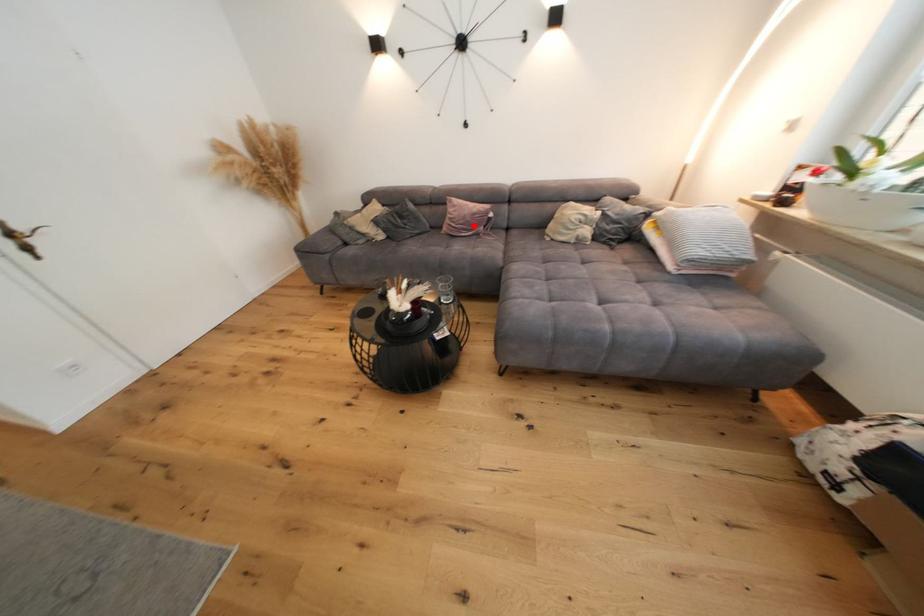
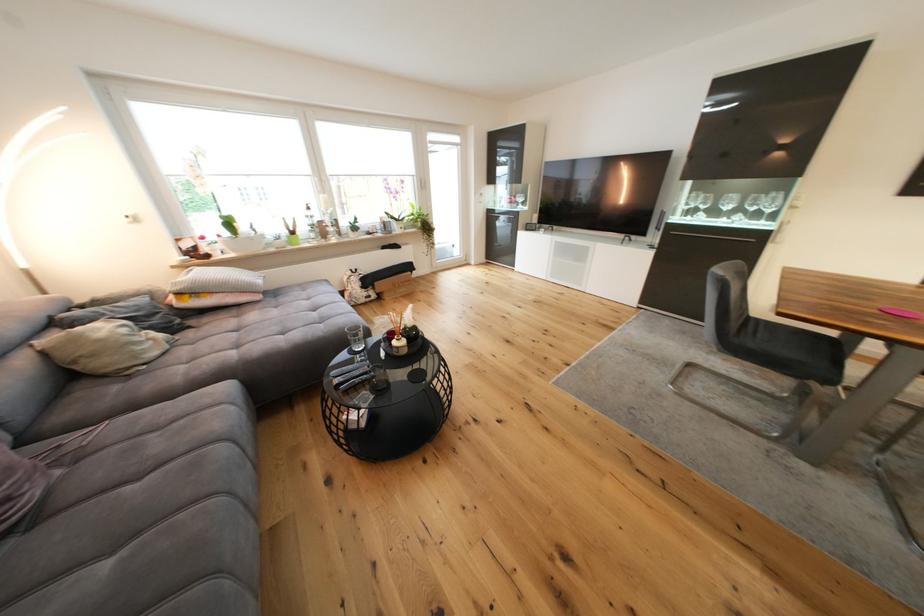
Question: I am providing you with two images of the same scene from different viewpoints. In image1, a red point is highlighted. Considering the same 3D point in image2, which of the following is correct?

Choices:
 (A) It is closer
 (B) It is farther

Answer: (B)